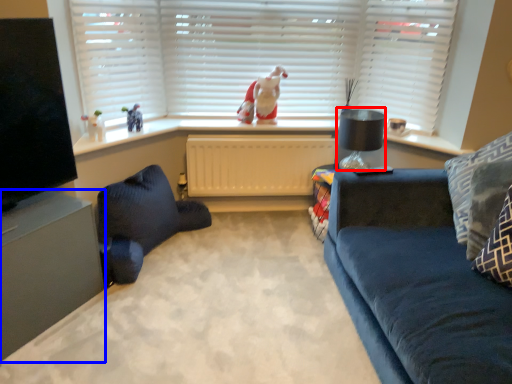
Question: Among these objects, which one is nearest to the camera, lamp (highlighted by a red box) or entertainment center (highlighted by a blue box)?

Choices:
 (A) lamp
 (B) entertainment center

Answer: (B)